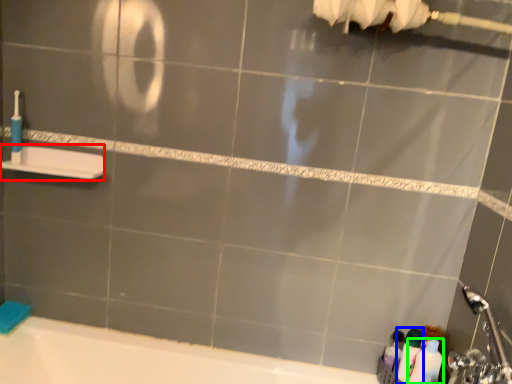
Question: Which object is the farthest from towel bar (highlighted by a red box)? Choose among these: cleaning product (highlighted by a blue box) or toiletry (highlighted by a green box).

Choices:
 (A) cleaning product
 (B) toiletry

Answer: (B)